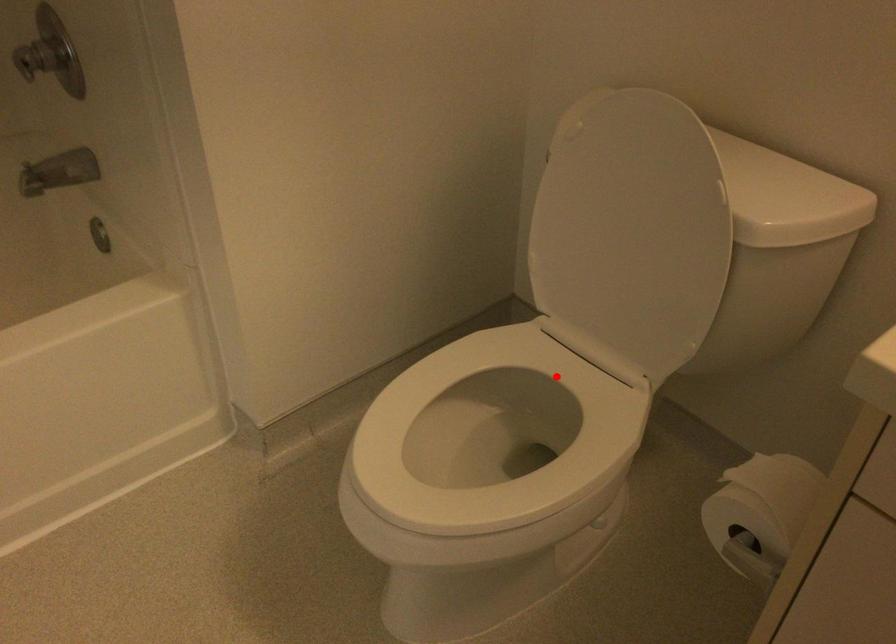
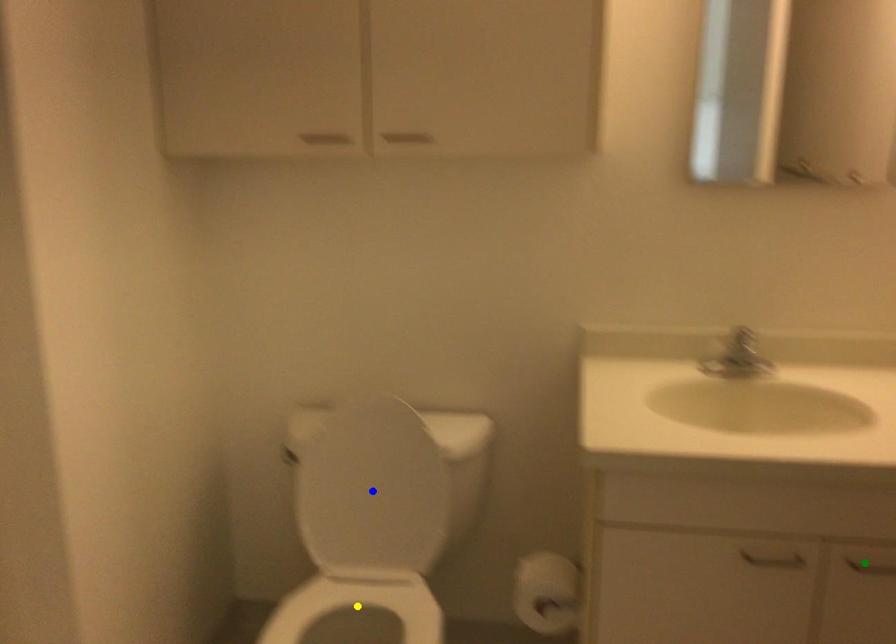
Question: I am providing you with two images of the same scene from different viewpoints. A red point is marked on the first image. You are given multiple points on the second image. Can you choose the point in image 2 that corresponds to the point in image 1?

Choices:
 (A) blue point
 (B) green point
 (C) yellow point

Answer: (C)